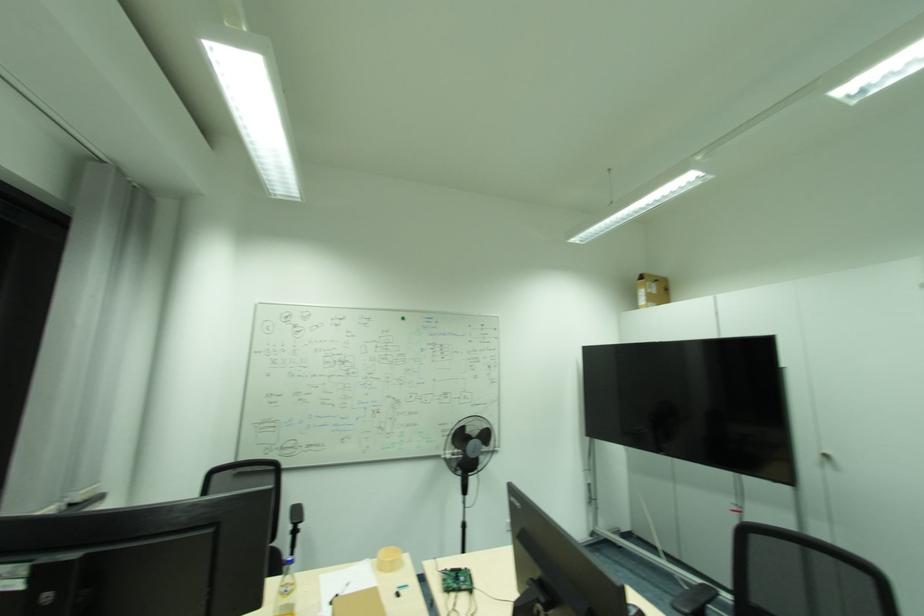
Image resolution: width=924 pixels, height=616 pixels. In order to click on cardboard box in this screenshot , I will do `click(651, 290)`.